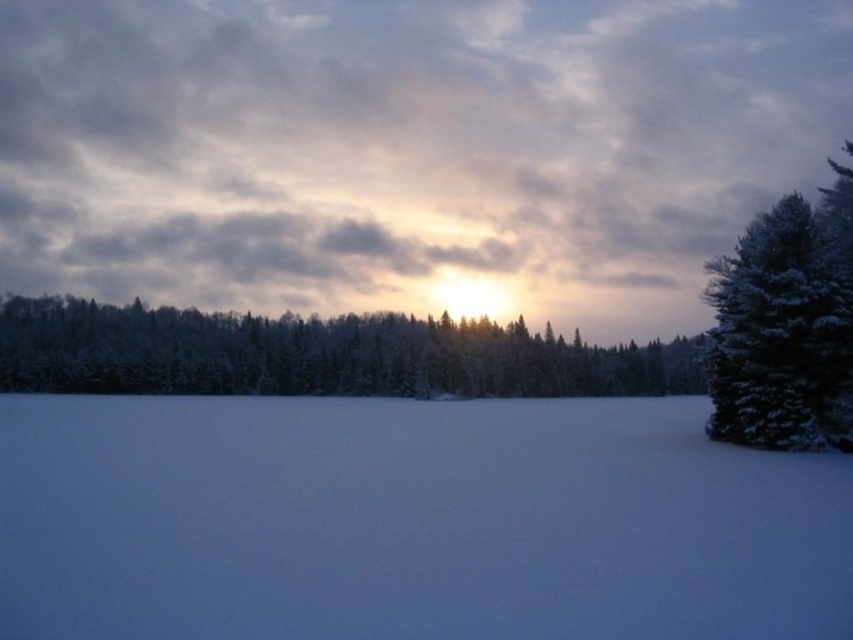
Does snow-covered evergreen trees at center appear on the right side of snow-covered evergreen at right?

Incorrect, snow-covered evergreen trees at center is not on the right side of snow-covered evergreen at right.

Who is more distant from viewer, (415, 380) or (817, 292)?

Point (415, 380)

Which is in front, point (434, 369) or point (776, 264)?

Point (776, 264) is in front.

Image resolution: width=853 pixels, height=640 pixels. I want to click on snow-covered evergreen trees at center, so click(317, 355).

Between white powdery snow at lower center and snow-covered evergreen trees at center, which one appears on the right side from the viewer's perspective?

Positioned to the right is snow-covered evergreen trees at center.

Is white powdery snow at lower center taller than snow-covered evergreen trees at center?

In fact, white powdery snow at lower center may be shorter than snow-covered evergreen trees at center.

Locate an element on the screen. This screenshot has height=640, width=853. white powdery snow at lower center is located at coordinates (410, 522).

Identify the location of white powdery snow at lower center. (410, 522).

Does white powdery snow at lower center appear over snow-covered evergreen at right?

Actually, white powdery snow at lower center is below snow-covered evergreen at right.

Is white powdery snow at lower center bigger than snow-covered evergreen at right?

Incorrect, white powdery snow at lower center is not larger than snow-covered evergreen at right.

Is point (759, 621) closer to viewer compared to point (808, 324)?

Yes.

Image resolution: width=853 pixels, height=640 pixels. I want to click on white powdery snow at lower center, so click(410, 522).